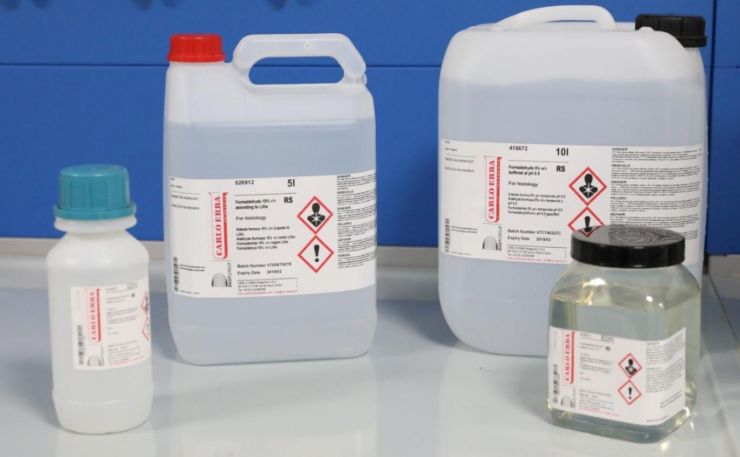
Find the location of `medium plastic jug`. medium plastic jug is located at coordinates (308, 131).